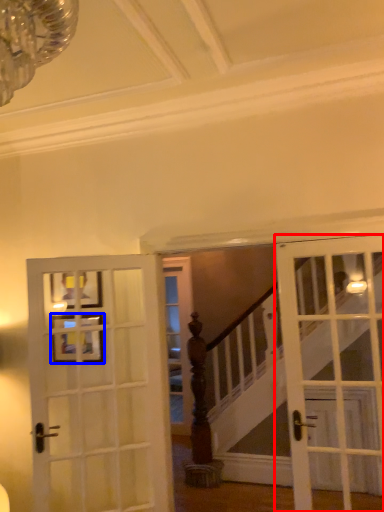
Question: Which point is further to the camera, door (highlighted by a red box) or picture frame (highlighted by a blue box)?

Choices:
 (A) door
 (B) picture frame

Answer: (B)